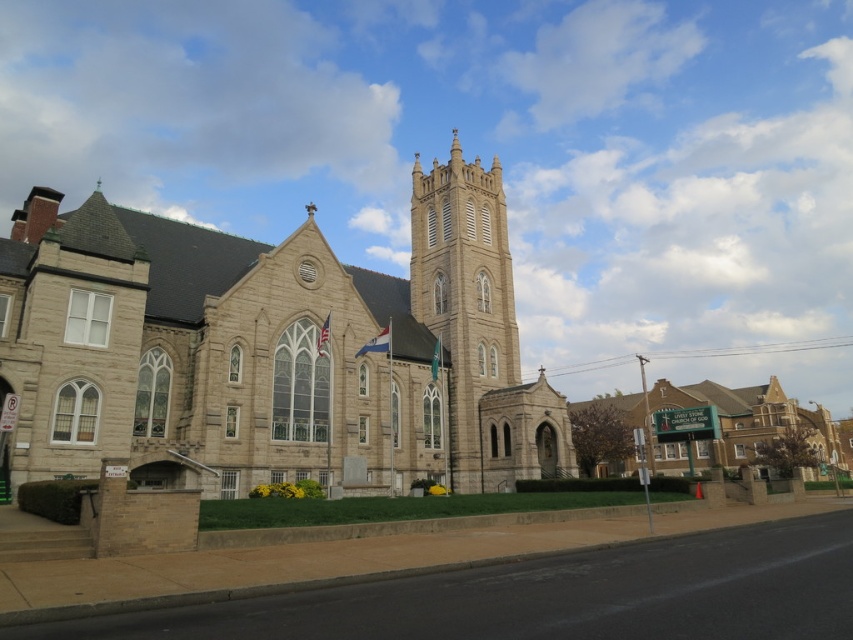
Looking at this image, you are standing in front of the beige stone church at center and the green signboard at center. Which object is closer to you?

The beige stone church at center is closer to you because it is in front of the green signboard at center.

You are a visitor standing in front of the church. You notice the beige stone tower at center and the green signboard at center. Which object appears narrower from your perspective?

The beige stone tower at center appears narrower than the green signboard at center.